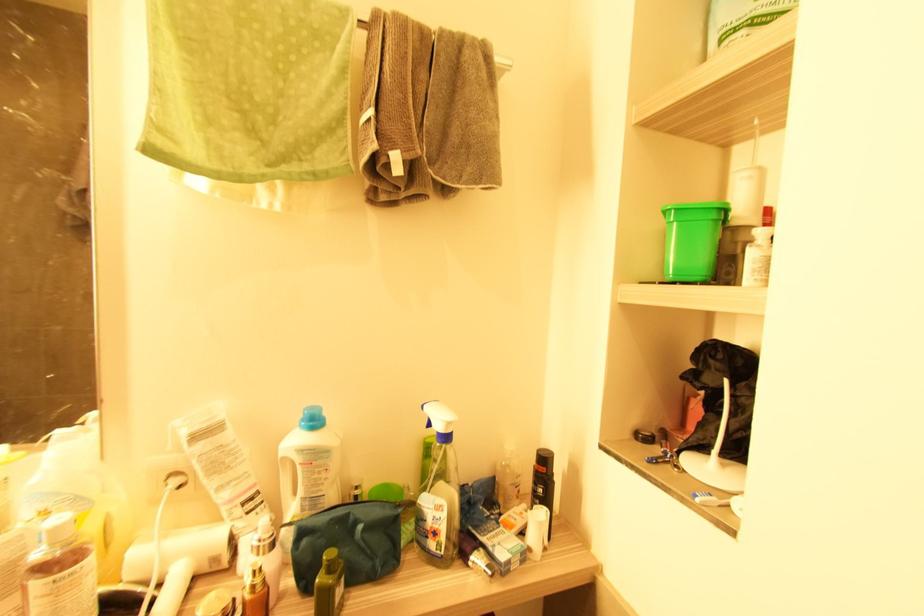
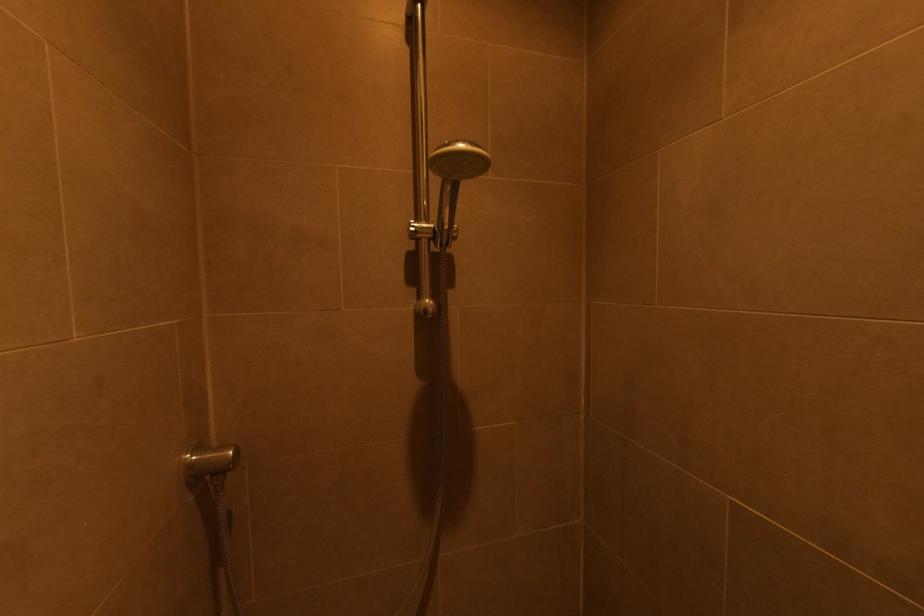
Which direction would the cameraman need to move to produce the second image?

The cameraman moved toward left, backward.